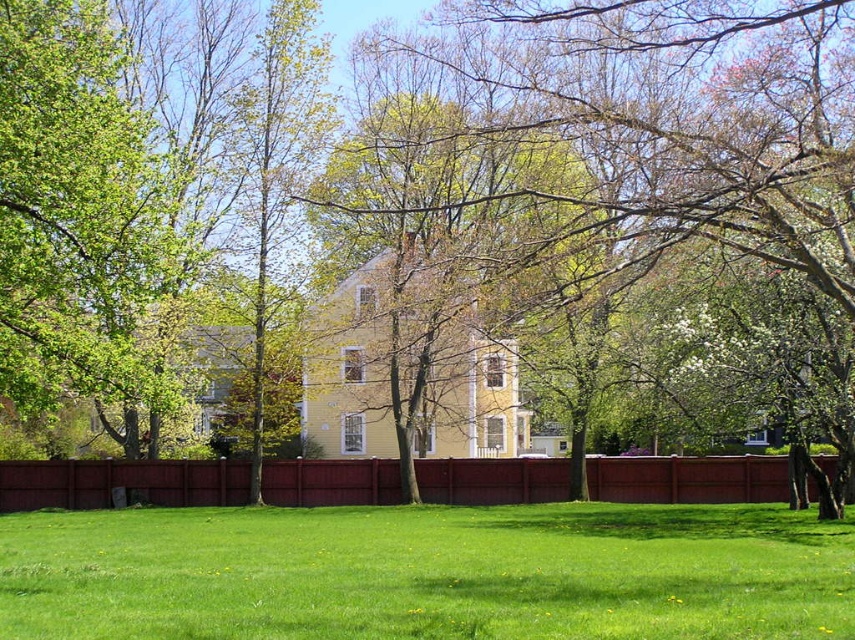
What do you see at coordinates (428, 573) in the screenshot? This screenshot has height=640, width=855. I see `green grass at center` at bounding box center [428, 573].

Is green grass at center smaller than burgundy wood fence at center?

Actually, green grass at center might be larger than burgundy wood fence at center.

Between point (227, 568) and point (697, 497), which one is positioned in front?

Point (227, 568) is more forward.

At what (x,y) coordinates should I click in order to perform the action: click on green grass at center. Please return your answer as a coordinate pair (x, y). This screenshot has width=855, height=640. Looking at the image, I should click on (428, 573).